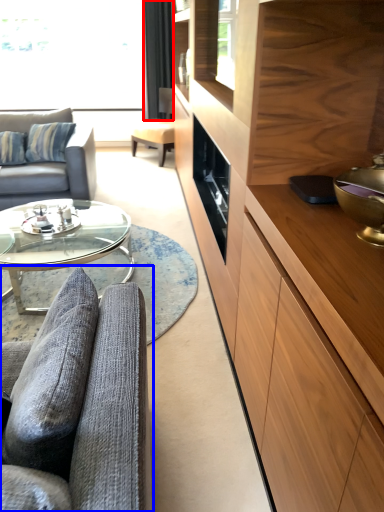
Question: Which of the following is the closest to the observer, curtain (highlighted by a red box) or studio couch (highlighted by a blue box)?

Choices:
 (A) curtain
 (B) studio couch

Answer: (B)